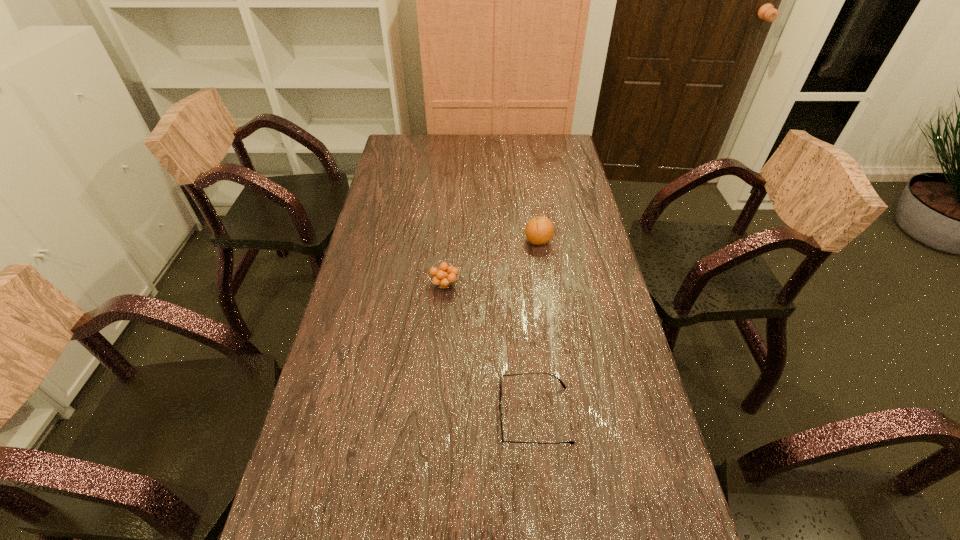
Choose which object is the nearest neighbor to the right orange fruit. Please provide its 2D coordinates. Your answer should be formatted as a tuple, i.e. [(x, y)], where the tuple contains the x and y coordinates of a point satisfying the conditions above.

[(444, 276)]

Identify which object is the nearest to the spectacles. Please provide its 2D coordinates. Your answer should be formatted as a tuple, i.e. [(x, y)], where the tuple contains the x and y coordinates of a point satisfying the conditions above.

[(444, 276)]

This screenshot has width=960, height=540. What are the coordinates of `vacant space that satisfies the following two spatial constraints: 1. on the back side of the farthest object; 2. on the left side of the nearer orange fruit` in the screenshot? It's located at (447, 241).